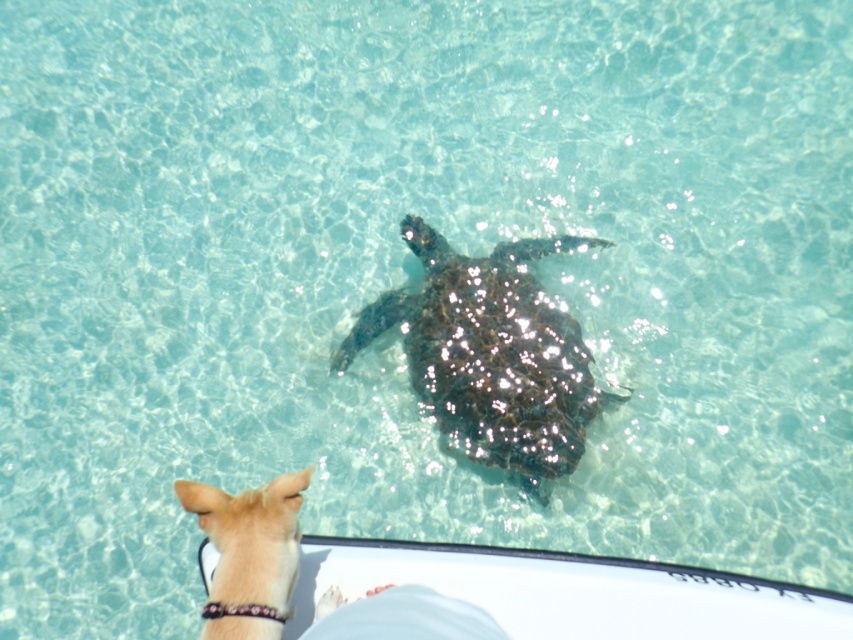
Question: Does shiny dark brown turtle at center appear over light brown fur at lower left?

Choices:
 (A) yes
 (B) no

Answer: (A)

Question: Is shiny dark brown turtle at center closer to camera compared to light brown fur at lower left?

Choices:
 (A) no
 (B) yes

Answer: (A)

Question: Which point appears farthest from the camera in this image?

Choices:
 (A) (521, 330)
 (B) (268, 636)

Answer: (A)

Question: Can you confirm if shiny dark brown turtle at center is bigger than light brown fur at lower left?

Choices:
 (A) yes
 (B) no

Answer: (A)

Question: Which object appears farthest from the camera in this image?

Choices:
 (A) shiny dark brown turtle at center
 (B) light brown fur at lower left

Answer: (A)

Question: Which point is closer to the camera?

Choices:
 (A) (289, 499)
 (B) (552, 353)

Answer: (A)